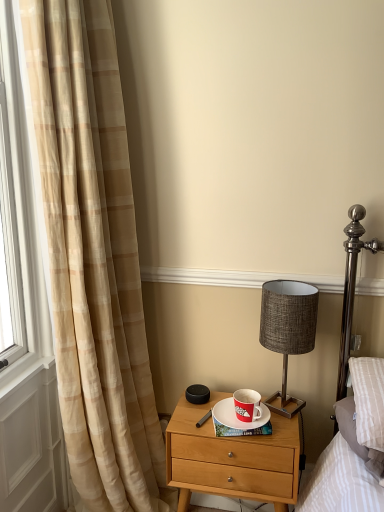
Describe the element at coordinates (94, 257) in the screenshot. I see `beige plaid curtain at left` at that location.

Where is `metallic gray lampshade at center-right`? The width and height of the screenshot is (384, 512). metallic gray lampshade at center-right is located at coordinates (288, 329).

Describe the element at coordinates (247, 405) in the screenshot. I see `red matte coffee cup at center` at that location.

At what (x,y) coordinates should I click in order to perform the action: click on beige plaid curtain at left. Please return your answer as a coordinate pair (x, y). Image resolution: width=384 pixels, height=512 pixels. Looking at the image, I should click on (94, 257).

From a real-world perspective, which object stands above the other?

From a 3D spatial view, metallic gray lampshade at center-right is above.

Can you tell me how much metallic gray lampshade at center-right and red matte coffee cup at center differ in facing direction?

2.16 degrees separate the facing orientations of metallic gray lampshade at center-right and red matte coffee cup at center.

Between metallic gray lampshade at center-right and red matte coffee cup at center, which one has larger width?

metallic gray lampshade at center-right.

Considering the relative sizes of metallic gray lampshade at center-right and red matte coffee cup at center in the image provided, is metallic gray lampshade at center-right shorter than red matte coffee cup at center?

No, metallic gray lampshade at center-right is not shorter than red matte coffee cup at center.

Which is correct: wooden nightstand at center is inside red matte coffee cup at center, or outside of it?

wooden nightstand at center exists outside the volume of red matte coffee cup at center.

Is wooden nightstand at center placed right next to red matte coffee cup at center?

No, wooden nightstand at center is not in contact with red matte coffee cup at center.

From a real-world perspective, who is located higher, wooden nightstand at center or red matte coffee cup at center?

red matte coffee cup at center is physically above.

How many degrees apart are the facing directions of beige plaid curtain at left and wooden nightstand at center?

The angular difference between beige plaid curtain at left and wooden nightstand at center is 178 degrees.

Relative to wooden nightstand at center, is beige plaid curtain at left in front or behind?

Clearly, beige plaid curtain at left is in front of wooden nightstand at center.

Considering the relative sizes of beige plaid curtain at left and wooden nightstand at center in the image provided, is beige plaid curtain at left smaller than wooden nightstand at center?

Incorrect, beige plaid curtain at left is not smaller in size than wooden nightstand at center.

Relative to beige plaid curtain at left, is metallic gray lampshade at center-right in front or behind?

In the image, metallic gray lampshade at center-right appears behind beige plaid curtain at left.

Is metallic gray lampshade at center-right located outside beige plaid curtain at left?

Yes, metallic gray lampshade at center-right is located beyond the bounds of beige plaid curtain at left.

At what (x,y) coordinates should I click in order to perform the action: click on curtain positioned vertically above the metallic gray lampshade at center-right (from a real-world perspective). Please return your answer as a coordinate pair (x, y). Looking at the image, I should click on (94, 257).

Considering the relative sizes of white ceramic saucer at center and beige plaid curtain at left in the image provided, is white ceramic saucer at center thinner than beige plaid curtain at left?

Yes.

This screenshot has height=512, width=384. In order to click on saucer behind the beige plaid curtain at left in this screenshot , I will do `click(236, 417)`.

Are white ceramic saucer at center and beige plaid curtain at left located far from each other?

They are positioned close to each other.

Is white ceramic saucer at center located within metallic gray lampshade at center-right?

No, white ceramic saucer at center is not a part of metallic gray lampshade at center-right.

Based on the photo, is metallic gray lampshade at center-right thinner than white ceramic saucer at center?

No, metallic gray lampshade at center-right is not thinner than white ceramic saucer at center.

Is metallic gray lampshade at center-right bigger or smaller than white ceramic saucer at center?

In the image, metallic gray lampshade at center-right appears to be larger than white ceramic saucer at center.

Locate an element on the screen. The height and width of the screenshot is (512, 384). curtain lying on the left of wooden nightstand at center is located at coordinates (94, 257).

Which is in front, point (226, 467) or point (60, 191)?

The point (60, 191) is more forward.

Is wooden nightstand at center in front of beige plaid curtain at left?

No, the depth of wooden nightstand at center is greater than that of beige plaid curtain at left.

Can beige plaid curtain at left be found inside wooden nightstand at center?

No, beige plaid curtain at left is not a part of wooden nightstand at center.

The width and height of the screenshot is (384, 512). I want to click on coffee cup that is under the metallic gray lampshade at center-right (from a real-world perspective), so click(x=247, y=405).

Where is `nightstand in front of the red matte coffee cup at center`? The height and width of the screenshot is (512, 384). nightstand in front of the red matte coffee cup at center is located at coordinates (231, 458).

Looking at the image, which one is located closer to white ceramic saucer at center, red matte coffee cup at center or metallic gray lampshade at center-right?

Among the two, red matte coffee cup at center is located nearer to white ceramic saucer at center.

Looking at the image, which one is located further to wooden nightstand at center, metallic gray lampshade at center-right or red matte coffee cup at center?

metallic gray lampshade at center-right lies further to wooden nightstand at center than the other object.

Based on their spatial positions, is white ceramic saucer at center or metallic gray lampshade at center-right closer to red matte coffee cup at center?

white ceramic saucer at center is closer to red matte coffee cup at center.

Considering their positions, is white ceramic saucer at center positioned closer to beige plaid curtain at left than wooden nightstand at center?

wooden nightstand at center lies closer to beige plaid curtain at left than the other object.

Looking at the image, which one is located closer to beige plaid curtain at left, metallic gray lampshade at center-right or wooden nightstand at center?

Among the two, wooden nightstand at center is located nearer to beige plaid curtain at left.

Looking at the image, which one is located closer to beige plaid curtain at left, red matte coffee cup at center or white ceramic saucer at center?

white ceramic saucer at center is closer to beige plaid curtain at left.

Based on their spatial positions, is metallic gray lampshade at center-right or white ceramic saucer at center closer to wooden nightstand at center?

Among the two, white ceramic saucer at center is located nearer to wooden nightstand at center.

Considering their positions, is wooden nightstand at center positioned closer to red matte coffee cup at center than metallic gray lampshade at center-right?

wooden nightstand at center is positioned closer to the anchor red matte coffee cup at center.

The image size is (384, 512). In order to click on saucer between beige plaid curtain at left and metallic gray lampshade at center-right in this screenshot , I will do `click(236, 417)`.

What are the coordinates of `saucer situated between beige plaid curtain at left and red matte coffee cup at center from left to right` in the screenshot? It's located at (236, 417).

You are a GUI agent. You are given a task and a screenshot of the screen. Output one action in this format:
    pyautogui.click(x=<x>, y=<y>)
    Task: Click on the table lamp between beige plaid curtain at left and wooden nightstand at center from top to bottom
    The height and width of the screenshot is (512, 384).
    Given the screenshot: What is the action you would take?
    pyautogui.click(x=288, y=329)

At what (x,y) coordinates should I click in order to perform the action: click on coffee cup between beige plaid curtain at left and wooden nightstand at center in the up-down direction. Please return your answer as a coordinate pair (x, y). Looking at the image, I should click on (247, 405).